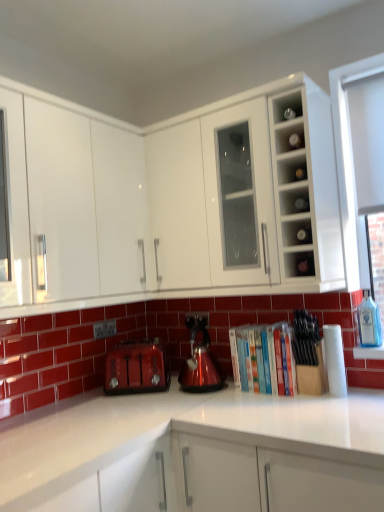
Describe the element at coordinates (348, 160) in the screenshot. The height and width of the screenshot is (512, 384). I see `clear glass window at upper right` at that location.

Locate an element on the screen. This screenshot has width=384, height=512. white glossy cabinet at upper center, the 1th cabinetry in the right-to-left sequence is located at coordinates (167, 201).

In order to face white glossy cabinet at upper left, the 1th cabinetry from the left, should I rotate leftwards or rightwards?

To align with it, rotate left about 13.686°.

This screenshot has height=512, width=384. I want to click on matte red toaster at lower left, so click(x=137, y=368).

Where is `clear glass window at upper right`? The width and height of the screenshot is (384, 512). clear glass window at upper right is located at coordinates (348, 160).

What's the angular difference between matte glass bottles at upper right, positioned as the first shelf in top-to-bottom order, and white glossy cabinet at upper center, the second cabinetry viewed from the left,'s facing directions?

0.00204 degrees.

Considering the relative sizes of matte glass bottles at upper right, positioned as the first shelf in top-to-bottom order, and white glossy cabinet at upper center, the 1th cabinetry in the right-to-left sequence, in the image provided, is matte glass bottles at upper right, positioned as the first shelf in top-to-bottom order, taller than white glossy cabinet at upper center, the 1th cabinetry in the right-to-left sequence,?

→ No.

Is matte glass bottles at upper right, the 4th shelf in the bottom-to-top sequence, completely or partially outside of white glossy cabinet at upper center, the second cabinetry viewed from the left?

No, matte glass bottles at upper right, the 4th shelf in the bottom-to-top sequence, is inside white glossy cabinet at upper center, the second cabinetry viewed from the left,'s boundary.

Which shelf is the 2nd one when counting from the front of the clear glass window at upper right? Please provide its 2D coordinates.

[(294, 201)]

Is clear glass bottles at upper right, marked as the second shelf in a top-to-bottom arrangement, not close to clear glass window at upper right?

No, clear glass bottles at upper right, marked as the second shelf in a top-to-bottom arrangement, is not far from clear glass window at upper right.

Relative to clear glass window at upper right, is clear glass bottles at upper right, marked as the second shelf in a top-to-bottom arrangement, in front or behind?

Clearly, clear glass bottles at upper right, marked as the second shelf in a top-to-bottom arrangement, is in front of clear glass window at upper right.

In the scene shown: Is clear glass bottles at upper right, marked as the second shelf in a top-to-bottom arrangement, wider or thinner than clear glass window at upper right?

Considering their sizes, clear glass bottles at upper right, marked as the second shelf in a top-to-bottom arrangement, looks broader than clear glass window at upper right.

Is point (338, 161) behind point (302, 256)?

Yes, point (338, 161) is farther from viewer.

From the image's perspective, does clear glass window at upper right appear lower than matte glass shelf at upper right, which is the 1th shelf from bottom to top?

No, from the image's perspective, clear glass window at upper right is not beneath matte glass shelf at upper right, which is the 1th shelf from bottom to top.

Can you see clear glass window at upper right touching matte glass shelf at upper right, which is counted as the 4th shelf, starting from the top?

There is a gap between clear glass window at upper right and matte glass shelf at upper right, which is counted as the 4th shelf, starting from the top.

How many degrees apart are the facing directions of clear glass window at upper right and matte glass shelf at upper right, which is the 1th shelf from bottom to top?

0.00925 degrees separate the facing orientations of clear glass window at upper right and matte glass shelf at upper right, which is the 1th shelf from bottom to top.

Is white glossy cabinet at upper left, the 1th cabinetry from the left, facing away from matte glass bottles at upper right, positioned as the first shelf in top-to-bottom order?

white glossy cabinet at upper left, the 1th cabinetry from the left, does not have its back to matte glass bottles at upper right, positioned as the first shelf in top-to-bottom order.

Is white glossy cabinet at upper left, the 1th cabinetry from the left, positioned behind matte glass bottles at upper right, positioned as the first shelf in top-to-bottom order?

No, white glossy cabinet at upper left, the 1th cabinetry from the left, is closer to the camera.

Which of these two, white glossy cabinet at upper left, which is the 2th cabinetry in right-to-left order, or matte glass bottles at upper right, positioned as the first shelf in top-to-bottom order, is wider?

white glossy cabinet at upper left, which is the 2th cabinetry in right-to-left order, is wider.

I want to click on the 2nd shelf to the left of the matte glass shelf at upper right, which is counted as the 4th shelf, starting from the top, starting your count from the anchor, so click(294, 201).

From a real-world perspective, is clear glass bottles at upper right, marked as the second shelf in a top-to-bottom arrangement, below matte glass shelf at upper right, which is the 1th shelf from bottom to top?

No, from a real-world perspective, clear glass bottles at upper right, marked as the second shelf in a top-to-bottom arrangement, is not beneath matte glass shelf at upper right, which is the 1th shelf from bottom to top.

Is clear glass bottles at upper right, placed as the third shelf when sorted from bottom to top, wider or thinner than matte glass shelf at upper right, which is counted as the 4th shelf, starting from the top?

Clearly, clear glass bottles at upper right, placed as the third shelf when sorted from bottom to top, has less width compared to matte glass shelf at upper right, which is counted as the 4th shelf, starting from the top.

Is clear glass bottles at upper right, placed as the third shelf when sorted from bottom to top, oriented away from matte glass shelf at upper right, which is the 1th shelf from bottom to top?

That's not correct — clear glass bottles at upper right, placed as the third shelf when sorted from bottom to top, is not looking away from matte glass shelf at upper right, which is the 1th shelf from bottom to top.

In the scene shown: Is the depth of white glossy cabinet at upper center, the 1th cabinetry in the right-to-left sequence, greater than that of matte glass shelf at upper right, which is counted as the 4th shelf, starting from the top?

No, it is in front of matte glass shelf at upper right, which is counted as the 4th shelf, starting from the top.

Can you tell me how much white glossy cabinet at upper center, the second cabinetry viewed from the left, and matte glass shelf at upper right, which is the 1th shelf from bottom to top, differ in facing direction?

The angle between the facing direction of white glossy cabinet at upper center, the second cabinetry viewed from the left, and the facing direction of matte glass shelf at upper right, which is the 1th shelf from bottom to top, is 0.00143 degrees.

Does white glossy cabinet at upper center, the second cabinetry viewed from the left, contain matte glass shelf at upper right, which is counted as the 4th shelf, starting from the top?

Yes, matte glass shelf at upper right, which is counted as the 4th shelf, starting from the top, is a part of white glossy cabinet at upper center, the second cabinetry viewed from the left.

Is clear glass bottles at upper right, placed as the third shelf when sorted from bottom to top, aimed at hardcover books at center?

No, clear glass bottles at upper right, placed as the third shelf when sorted from bottom to top, does not turn towards hardcover books at center.

From the image's perspective, is clear glass bottles at upper right, placed as the third shelf when sorted from bottom to top, below hardcover books at center?

No, from the image's perspective, clear glass bottles at upper right, placed as the third shelf when sorted from bottom to top, is not below hardcover books at center.

Locate an element on the screen. Image resolution: width=384 pixels, height=512 pixels. book below the clear glass bottles at upper right, marked as the second shelf in a top-to-bottom arrangement (from a real-world perspective) is located at coordinates (265, 359).

Considering the sizes of clear glass bottles at upper right, placed as the third shelf when sorted from bottom to top, and hardcover books at center in the image, is clear glass bottles at upper right, placed as the third shelf when sorted from bottom to top, taller or shorter than hardcover books at center?

In the image, clear glass bottles at upper right, placed as the third shelf when sorted from bottom to top, appears to be shorter than hardcover books at center.

At what (x,y) coordinates should I click in order to perform the action: click on the 1st cabinetry positioned below the matte glass bottles at upper right, positioned as the first shelf in top-to-bottom order (from a real-world perspective). Please return your answer as a coordinate pair (x, y). The height and width of the screenshot is (512, 384). Looking at the image, I should click on (167, 201).

I want to click on shelf that is the 3rd object to the left of the clear glass window at upper right, starting at the anchor, so click(x=294, y=201).

Looking at the image, which one is located closer to white glossy cabinet at upper center, the 1th cabinetry in the right-to-left sequence, matte glass shelf at upper right, which is counted as the 4th shelf, starting from the top, or clear glass window at upper right?

matte glass shelf at upper right, which is counted as the 4th shelf, starting from the top, is positioned closer to the anchor white glossy cabinet at upper center, the 1th cabinetry in the right-to-left sequence.

Based on their spatial positions, is white glossy cabinet at upper center, the second cabinetry viewed from the left, or matte red toaster at lower left closer to shiny metallic kettle at center?

The object closer to shiny metallic kettle at center is matte red toaster at lower left.

Based on their spatial positions, is matte red toaster at lower left or clear glass bottles at upper right, placed as the third shelf when sorted from bottom to top, closer to shiny metallic kettle at center?

The object closer to shiny metallic kettle at center is matte red toaster at lower left.

From the image, which object appears to be farther from matte red toaster at lower left, clear glass bottles at upper right, arranged as the third shelf when viewed from the top, or clear glass window at upper right?

The object further to matte red toaster at lower left is clear glass window at upper right.

When comparing their distances from matte glass shelf at upper right, which is the 1th shelf from bottom to top, does clear glass window at upper right or matte glass bottles at upper right, the 4th shelf in the bottom-to-top sequence, seem further?

Among the two, matte glass bottles at upper right, the 4th shelf in the bottom-to-top sequence, is located further to matte glass shelf at upper right, which is the 1th shelf from bottom to top.

Based on their spatial positions, is matte glass shelf at upper right, which is counted as the 4th shelf, starting from the top, or clear glass bottles at upper right, marked as the second shelf in a top-to-bottom arrangement, further from white glossy cabinet at upper center, the second cabinetry viewed from the left?

The object further to white glossy cabinet at upper center, the second cabinetry viewed from the left, is matte glass shelf at upper right, which is counted as the 4th shelf, starting from the top.

Based on their spatial positions, is clear glass bottles at upper right, marked as the second shelf in a top-to-bottom arrangement, or white glossy cabinet at upper center, the second cabinetry viewed from the left, further from hardcover books at center?

white glossy cabinet at upper center, the second cabinetry viewed from the left, is further to hardcover books at center.

From the image, which object appears to be nearer to white glossy cabinet at upper center, the second cabinetry viewed from the left, clear glass window at upper right or shiny metallic kettle at center?

clear glass window at upper right is closer to white glossy cabinet at upper center, the second cabinetry viewed from the left.

The width and height of the screenshot is (384, 512). What are the coordinates of `kitchen appliance situated between matte red toaster at lower left and hardcover books at center from left to right` in the screenshot? It's located at (200, 360).

Where is `book that lies between matte glass bottles at upper right, positioned as the first shelf in top-to-bottom order, and matte red toaster at lower left from top to bottom`? The height and width of the screenshot is (512, 384). book that lies between matte glass bottles at upper right, positioned as the first shelf in top-to-bottom order, and matte red toaster at lower left from top to bottom is located at coordinates point(265,359).

Where is `book between white glossy cabinet at upper left, which is the 2th cabinetry in right-to-left order, and matte glass shelf at upper right, which is counted as the 4th shelf, starting from the top, in the horizontal direction`? Image resolution: width=384 pixels, height=512 pixels. book between white glossy cabinet at upper left, which is the 2th cabinetry in right-to-left order, and matte glass shelf at upper right, which is counted as the 4th shelf, starting from the top, in the horizontal direction is located at coordinates (265, 359).

At what (x,y) coordinates should I click in order to perform the action: click on book between clear glass bottles at upper right, the second shelf in the bottom-to-top sequence, and shiny metallic kettle at center, in the vertical direction. Please return your answer as a coordinate pair (x, y). This screenshot has height=512, width=384. Looking at the image, I should click on (265, 359).